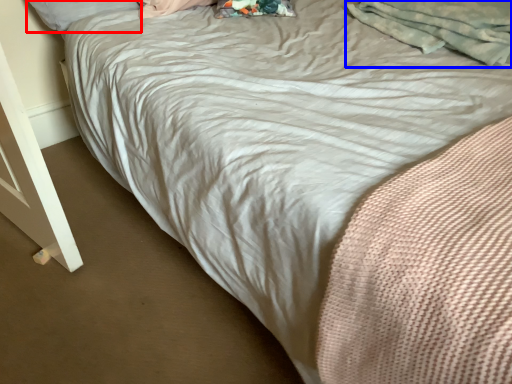
Question: Which point is further to the camera, pillow (highlighted by a red box) or material (highlighted by a blue box)?

Choices:
 (A) pillow
 (B) material

Answer: (A)